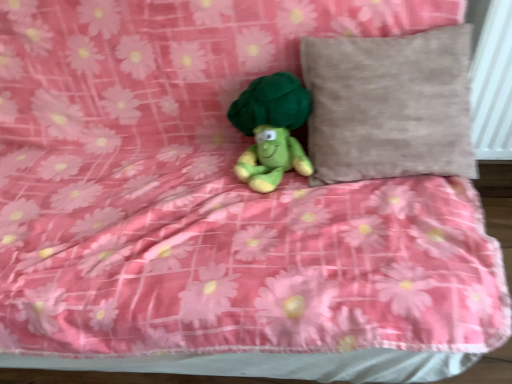
What is the approximate height of green plush toy at center?

green plush toy at center is 20.06 centimeters in height.

Image resolution: width=512 pixels, height=384 pixels. What do you see at coordinates (271, 129) in the screenshot?
I see `green plush toy at center` at bounding box center [271, 129].

Find the location of a particular element. The image size is (512, 384). green plush toy at center is located at coordinates (271, 129).

Measure the distance between beige textured pillow at upper right and camera.

beige textured pillow at upper right and camera are 88.27 centimeters apart from each other.

At what (x,y) coordinates should I click in order to perform the action: click on beige textured pillow at upper right. Please return your answer as a coordinate pair (x, y). Looking at the image, I should click on (389, 105).

Describe the element at coordinates (389, 105) in the screenshot. Image resolution: width=512 pixels, height=384 pixels. I see `beige textured pillow at upper right` at that location.

Find the location of a particular element. Image resolution: width=512 pixels, height=384 pixels. green plush toy at center is located at coordinates (271, 129).

Between green plush toy at center and beige textured pillow at upper right, which one appears on the left side from the viewer's perspective?

green plush toy at center.

Considering the positions of objects green plush toy at center and beige textured pillow at upper right in the image provided, who is in front, green plush toy at center or beige textured pillow at upper right?

Positioned in front is beige textured pillow at upper right.

Does point (262, 175) lie in front of point (329, 148)?

That is False.

From the image's perspective, which one is positioned lower, green plush toy at center or beige textured pillow at upper right?

green plush toy at center, from the image's perspective.

From a real-world perspective, who is located higher, green plush toy at center or beige textured pillow at upper right?

beige textured pillow at upper right, from a real-world perspective.

Based on the photo, does green plush toy at center have a lesser width compared to beige textured pillow at upper right?

Indeed, green plush toy at center has a lesser width compared to beige textured pillow at upper right.

Can you confirm if green plush toy at center is taller than beige textured pillow at upper right?

In fact, green plush toy at center may be shorter than beige textured pillow at upper right.

Which of these two, green plush toy at center or beige textured pillow at upper right, is smaller?

Smaller between the two is green plush toy at center.

Do you think green plush toy at center is within beige textured pillow at upper right, or outside of it?

green plush toy at center is outside beige textured pillow at upper right.

From the picture: Would you consider green plush toy at center to be distant from beige textured pillow at upper right?

green plush toy at center is actually quite close to beige textured pillow at upper right.

Is green plush toy at center positioned with its back to beige textured pillow at upper right?

green plush toy at center is not turned away from beige textured pillow at upper right.

What's the angular difference between green plush toy at center and beige textured pillow at upper right's facing directions?

The facing directions of green plush toy at center and beige textured pillow at upper right are 6.53e-05 degrees apart.

Locate an element on the screen. Image resolution: width=512 pixels, height=384 pixels. toy located on the left of beige textured pillow at upper right is located at coordinates (271, 129).

Which object is positioned more to the right, beige textured pillow at upper right or green plush toy at center?

beige textured pillow at upper right.

Between beige textured pillow at upper right and green plush toy at center, which one is positioned behind?

Positioned behind is green plush toy at center.

Is point (437, 156) farther from viewer compared to point (282, 125)?

No, it is in front of (282, 125).

Consider the image. From the image's perspective, would you say beige textured pillow at upper right is shown under green plush toy at center?

No, from the image's perspective, beige textured pillow at upper right is not below green plush toy at center.

From a real-world perspective, is beige textured pillow at upper right physically above green plush toy at center?

Yes, from a real-world perspective, beige textured pillow at upper right is over green plush toy at center

In terms of width, does beige textured pillow at upper right look wider or thinner when compared to green plush toy at center?

Considering their sizes, beige textured pillow at upper right looks broader than green plush toy at center.

Is beige textured pillow at upper right shorter than green plush toy at center?

No, beige textured pillow at upper right is not shorter than green plush toy at center.

Is beige textured pillow at upper right bigger than green plush toy at center?

Correct, beige textured pillow at upper right is larger in size than green plush toy at center.

Choose the correct answer: Is beige textured pillow at upper right inside green plush toy at center or outside it?

beige textured pillow at upper right lies outside green plush toy at center.

Are beige textured pillow at upper right and green plush toy at center far apart?

No, beige textured pillow at upper right is not far away from green plush toy at center.

Is beige textured pillow at upper right looking in the opposite direction of green plush toy at center?

No, beige textured pillow at upper right's orientation is not away from green plush toy at center.

How different are the orientations of beige textured pillow at upper right and green plush toy at center in degrees?

The angular difference between beige textured pillow at upper right and green plush toy at center is 6.53e-05 degrees.

Find the location of a particular element. The width and height of the screenshot is (512, 384). toy below the beige textured pillow at upper right (from the image's perspective) is located at coordinates (271, 129).

Where is `toy below the beige textured pillow at upper right (from the image's perspective)`? The width and height of the screenshot is (512, 384). toy below the beige textured pillow at upper right (from the image's perspective) is located at coordinates (271, 129).

Locate an element on the screen. The width and height of the screenshot is (512, 384). pillow to the right of green plush toy at center is located at coordinates click(389, 105).